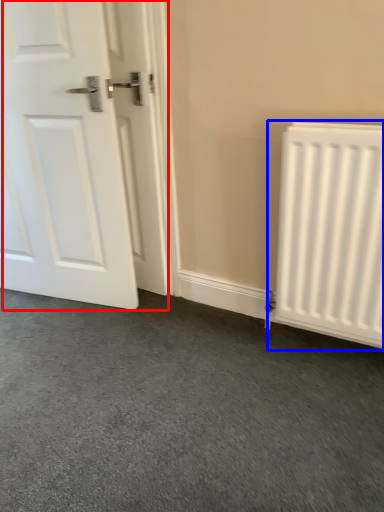
Question: Which object is further to the camera taking this photo, door (highlighted by a red box) or radiator (highlighted by a blue box)?

Choices:
 (A) door
 (B) radiator

Answer: (A)